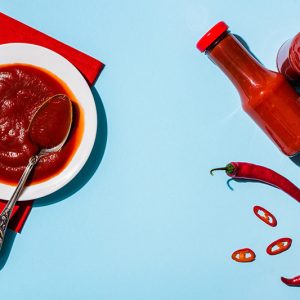
You are a GUI agent. You are given a task and a screenshot of the screen. Output one action in this format:
    pyautogui.click(x=<x>, y=<y>)
    Task: Click on the red paper/napking
    This screenshot has height=300, width=300.
    Given the screenshot: What is the action you would take?
    pyautogui.click(x=7, y=20), pyautogui.click(x=45, y=41), pyautogui.click(x=74, y=51), pyautogui.click(x=23, y=221)